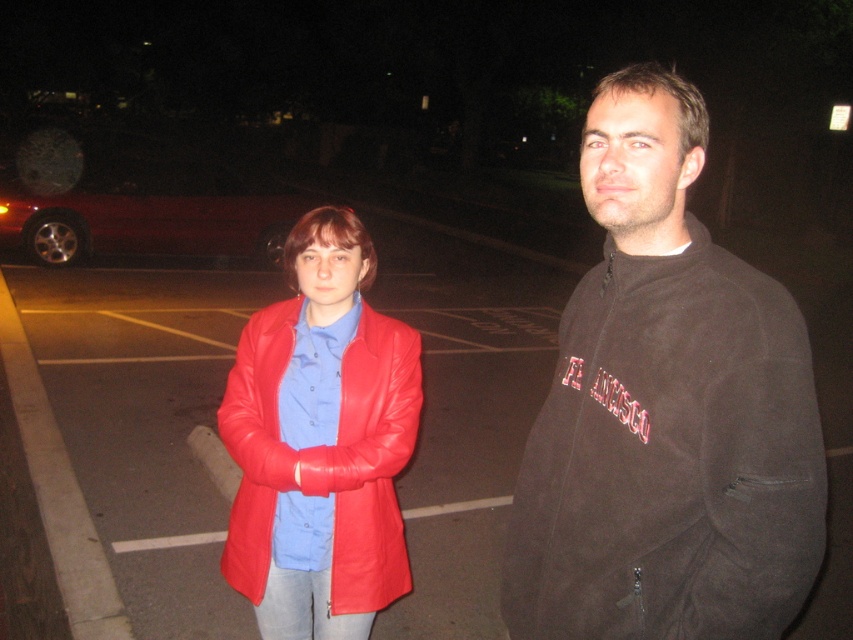
Is point (547, 541) positioned after point (273, 636)?

No.

Is dark brown fleece jacket at center above shiny red leather jacket at center?

Correct, dark brown fleece jacket at center is located above shiny red leather jacket at center.

Describe the element at coordinates (666, 412) in the screenshot. This screenshot has width=853, height=640. I see `dark brown fleece jacket at center` at that location.

This screenshot has width=853, height=640. I want to click on dark brown fleece jacket at center, so click(666, 412).

Can you confirm if dark brown fleece jacket at center is positioned below shiny red car at left?

Yes.

Does dark brown fleece jacket at center have a lesser width compared to shiny red car at left?

Yes.

Identify the location of dark brown fleece jacket at center. The height and width of the screenshot is (640, 853). (666, 412).

Is point (294, 547) less distant than point (91, 220)?

That is True.

Measure the distance between point [306,333] and camera.

A distance of 2.26 meters exists between point [306,333] and camera.

What are the coordinates of `shiny red leather jacket at center` in the screenshot? It's located at (320, 442).